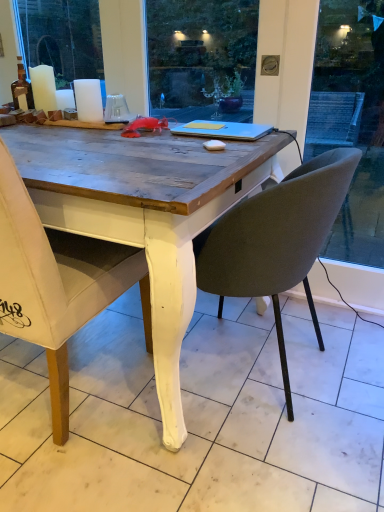
This screenshot has width=384, height=512. Find the location of `free space in front of matte gray chair at center, the second chair from the left`. free space in front of matte gray chair at center, the second chair from the left is located at coordinates (218, 458).